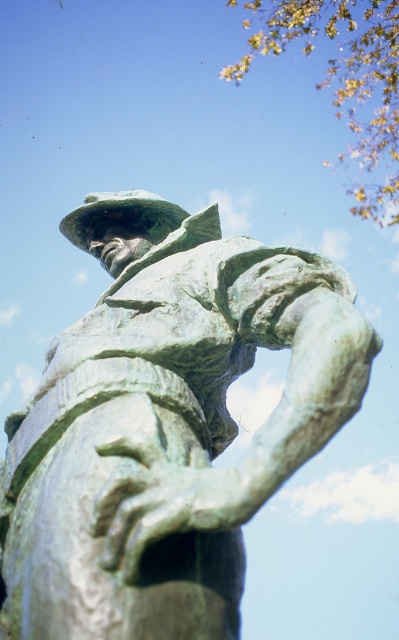
Question: Which point is closer to the camera taking this photo?

Choices:
 (A) (223, 250)
 (B) (122, 198)

Answer: (A)

Question: Does green patina statue at center appear on the right side of green patina hat at center?

Choices:
 (A) no
 (B) yes

Answer: (B)

Question: Is green patina statue at center to the left of green patina hat at center from the viewer's perspective?

Choices:
 (A) no
 (B) yes

Answer: (A)

Question: Which object appears closest to the camera in this image?

Choices:
 (A) green patina statue at center
 (B) green patina hat at center

Answer: (A)

Question: Does green patina statue at center appear over green patina hat at center?

Choices:
 (A) yes
 (B) no

Answer: (B)